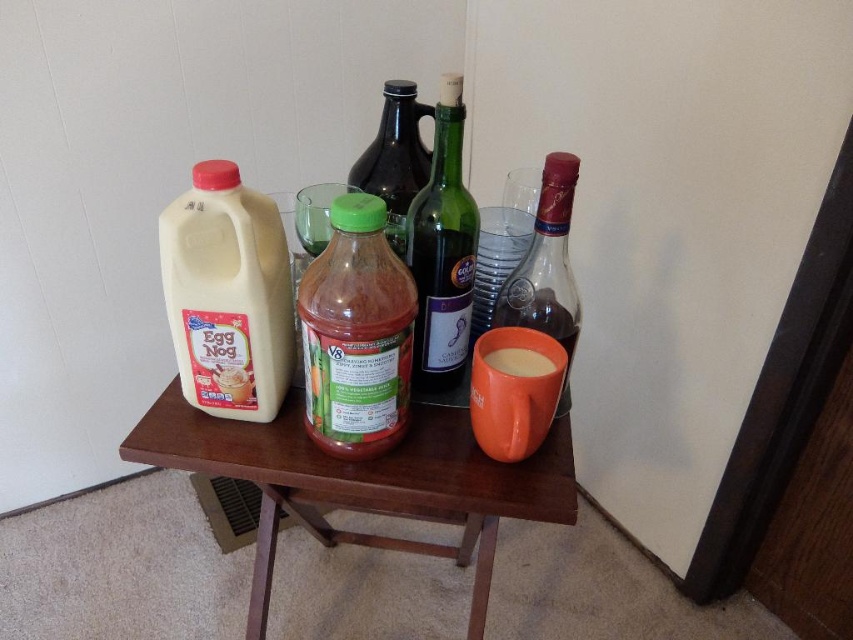
Image resolution: width=853 pixels, height=640 pixels. Describe the element at coordinates (227, 291) in the screenshot. I see `white matte jug at left` at that location.

Is the position of white matte jug at left more distant than that of translucent glass bottle at right?

That is False.

This screenshot has height=640, width=853. What are the coordinates of `white matte jug at left` in the screenshot? It's located at (227, 291).

The height and width of the screenshot is (640, 853). Identify the location of white matte jug at left. (227, 291).

Is green matte plastic bottle at center positioned behind green glass bottle at center?

No, it is in front of green glass bottle at center.

Based on the photo, is green matte plastic bottle at center bigger than green glass bottle at center?

Correct, green matte plastic bottle at center is larger in size than green glass bottle at center.

Image resolution: width=853 pixels, height=640 pixels. What are the coordinates of `green matte plastic bottle at center` in the screenshot? It's located at (357, 333).

Find the location of a particular element. This screenshot has height=640, width=853. green matte plastic bottle at center is located at coordinates (357, 333).

Between point (408, 483) and point (204, 385), which one is positioned in front?

Point (408, 483) is more forward.

What do you see at coordinates (364, 483) in the screenshot?
I see `wooden table at center` at bounding box center [364, 483].

You are a GUI agent. You are given a task and a screenshot of the screen. Output one action in this format:
    pyautogui.click(x=<x>, y=<y>)
    Task: Click on the wooden table at center
    
    Given the screenshot: What is the action you would take?
    pyautogui.click(x=364, y=483)